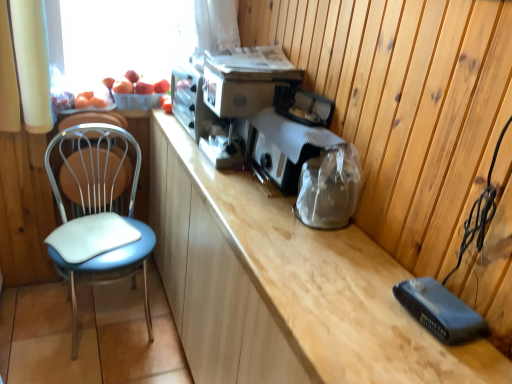
Locate an element on the screen. The width and height of the screenshot is (512, 384). free space above wooden cabinet at center (from a real-world perspective) is located at coordinates (234, 190).